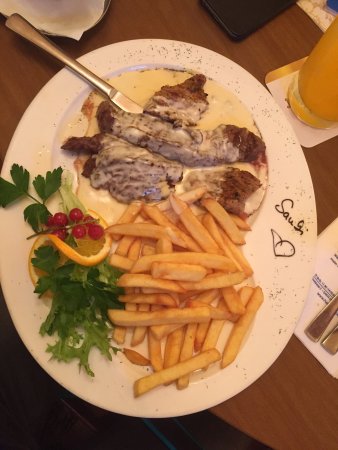
Identify the location of white plate. This screenshot has height=450, width=338. (286, 165).